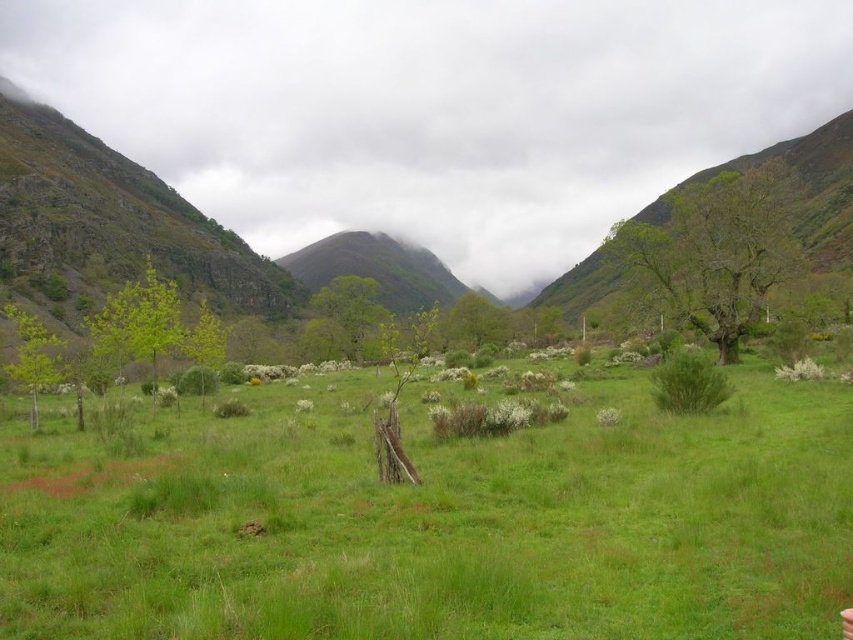
Between green grassy at center and green grassy mountain at left, which one is positioned lower?

green grassy at center is lower down.

Locate an element on the screen. green grassy at center is located at coordinates (434, 518).

In order to click on green grassy at center in this screenshot , I will do `click(434, 518)`.